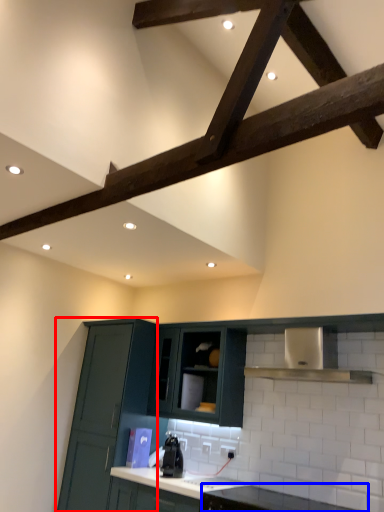
Question: Which point is further to the camera, cabinetry (highlighted by a red box) or countertop (highlighted by a blue box)?

Choices:
 (A) cabinetry
 (B) countertop

Answer: (A)